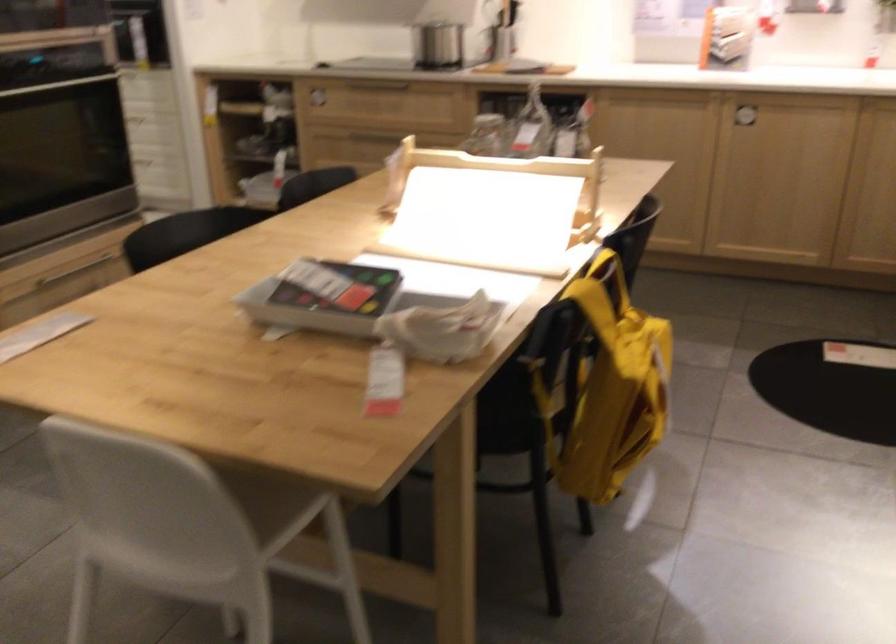
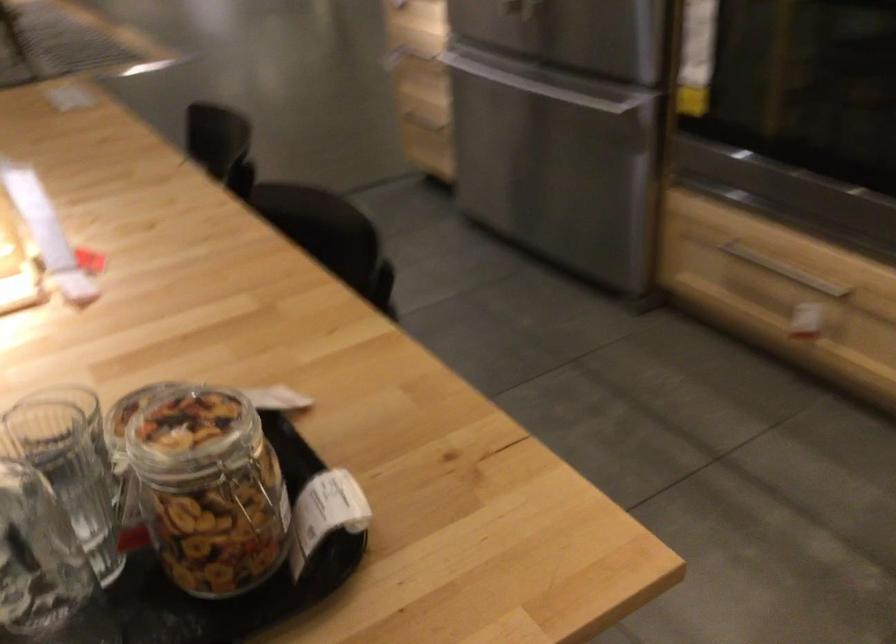
Find the pixel in the second image that matches (483,129) in the first image.

(250, 493)